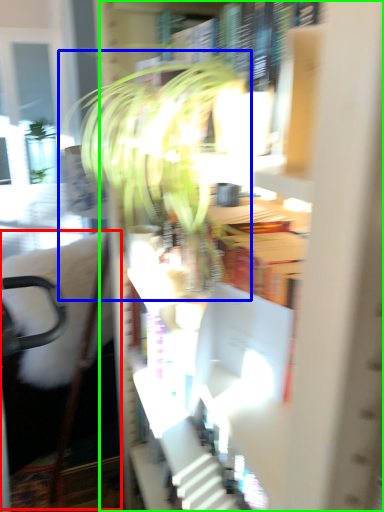
Question: Which object is positioned farthest from swivel chair (highlighted by a red box)? Select from houseplant (highlighted by a blue box) and bookcase (highlighted by a green box).

Choices:
 (A) houseplant
 (B) bookcase

Answer: (B)